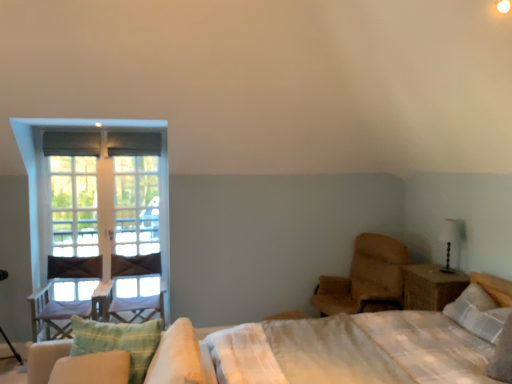
In order to face white textured pillow at upper right, the first pillow in the back-to-front sequence, should I rotate leftwards or rightwards?

You should look right and rotate roughly 27.776 degrees.

The width and height of the screenshot is (512, 384). Find the location of `wooden nightstand at right`. wooden nightstand at right is located at coordinates pos(431,287).

How much space does white wooden window at left, positioned as the 1th window in right-to-left order, occupy vertically?

5.51 feet.

Image resolution: width=512 pixels, height=384 pixels. Describe the element at coordinates (366, 279) in the screenshot. I see `brown leather chair at right, placed as the 1th chair when sorted from right to left` at that location.

Locate an element on the screen. light beige fabric mattress at right is located at coordinates (352, 350).

The width and height of the screenshot is (512, 384). Identify the location of white textured pillow at upper right, the first pillow when ordered from right to left. (478, 313).

From the picture: From their relative heights in the image, would you say brown leather chair at right, placed as the 1th chair when sorted from right to left, is taller or shorter than wooden chair at left, which appears as the first chair when viewed from the left?

Clearly, brown leather chair at right, placed as the 1th chair when sorted from right to left, is taller compared to wooden chair at left, which appears as the first chair when viewed from the left.

Is brown leather chair at right, which is the second chair in left-to-right order, oriented away from wooden chair at left, positioned as the second chair in right-to-left order?

No, brown leather chair at right, which is the second chair in left-to-right order,'s orientation is not away from wooden chair at left, positioned as the second chair in right-to-left order.

Which object is further away from the camera taking this photo, brown leather chair at right, which is the second chair in left-to-right order, or wooden chair at left, positioned as the second chair in right-to-left order?

wooden chair at left, positioned as the second chair in right-to-left order, is more distant.

From the picture: Which object is further away from the camera, wooden chair at left, which appears as the first chair when viewed from the left, or brown leather chair at right, which is the second chair in left-to-right order?

Positioned behind is wooden chair at left, which appears as the first chair when viewed from the left.

In the scene shown: Is wooden chair at left, positioned as the second chair in right-to-left order, next to brown leather chair at right, which is the second chair in left-to-right order?

They are not placed beside each other.

Is wooden chair at left, positioned as the second chair in right-to-left order, shorter than brown leather chair at right, placed as the 1th chair when sorted from right to left?

Indeed, wooden chair at left, positioned as the second chair in right-to-left order, has a lesser height compared to brown leather chair at right, placed as the 1th chair when sorted from right to left.

From a real-world perspective, is wooden chair at left, which appears as the first chair when viewed from the left, above or below brown leather chair at right, which is the second chair in left-to-right order?

wooden chair at left, which appears as the first chair when viewed from the left, is situated lower than brown leather chair at right, which is the second chair in left-to-right order, in the real world.

From the image's perspective, which object appears higher, light beige fabric mattress at right or white wooden window at left, positioned as the 1th window in right-to-left order?

From the image's view, white wooden window at left, positioned as the 1th window in right-to-left order, is above.

In terms of height, does light beige fabric mattress at right look taller or shorter compared to white wooden window at left, positioned as the 1th window in right-to-left order?

Clearly, light beige fabric mattress at right is shorter compared to white wooden window at left, positioned as the 1th window in right-to-left order.

How much distance is there between light beige fabric mattress at right and white wooden window at left, the 2th window from the left?

light beige fabric mattress at right is 2.25 meters from white wooden window at left, the 2th window from the left.

Is light beige fabric mattress at right bigger or smaller than white wooden window at left, the 2th window from the left?

Clearly, light beige fabric mattress at right is larger in size than white wooden window at left, the 2th window from the left.

Does green striped pillow at lower left, the 2th pillow viewed from the back, have a larger size compared to white glass screen door at left?

Yes.

Is green striped pillow at lower left, the 2th pillow viewed from the back, with white glass screen door at left?

There is a gap between green striped pillow at lower left, the 2th pillow viewed from the back, and white glass screen door at left.

Is green striped pillow at lower left, the 2th pillow viewed from the right, oriented towards white glass screen door at left?

No, green striped pillow at lower left, the 2th pillow viewed from the right, is not oriented towards white glass screen door at left.

Which is closer to the camera, (142,327) or (140,172)?

Point (142,327) appears to be closer to the viewer than point (140,172).

Which of these two, matte black table lamp at right or green striped pillow at lower left, marked as the first pillow in a left-to-right arrangement, is thinner?

matte black table lamp at right.

From the image's perspective, is matte black table lamp at right positioned above or below green striped pillow at lower left, marked as the first pillow in a left-to-right arrangement?

matte black table lamp at right is above green striped pillow at lower left, marked as the first pillow in a left-to-right arrangement.

Looking at this image, measure the distance between matte black table lamp at right and green striped pillow at lower left, the 1th pillow positioned from the front.

matte black table lamp at right and green striped pillow at lower left, the 1th pillow positioned from the front, are 8.53 feet apart.

From a real-world perspective, which is physically below, light beige fabric mattress at right or white textured pillow at upper right, the first pillow in the back-to-front sequence?

From a 3D spatial view, light beige fabric mattress at right is below.

Considering the sizes of light beige fabric mattress at right and white textured pillow at upper right, the first pillow in the back-to-front sequence, in the image, is light beige fabric mattress at right bigger or smaller than white textured pillow at upper right, the first pillow in the back-to-front sequence,?

A: Considering their sizes, light beige fabric mattress at right takes up more space than white textured pillow at upper right, the first pillow in the back-to-front sequence.

Can you tell me how much light beige fabric mattress at right and white textured pillow at upper right, the second pillow in the left-to-right sequence, differ in facing direction?

The angle between the facing direction of light beige fabric mattress at right and the facing direction of white textured pillow at upper right, the second pillow in the left-to-right sequence, is 0.000179 degrees.

Considering the positions of objects light beige fabric mattress at right and white textured pillow at upper right, which ranks as the 2th pillow in front-to-back order, in the image provided, who is more to the right, light beige fabric mattress at right or white textured pillow at upper right, which ranks as the 2th pillow in front-to-back order,?

From the viewer's perspective, white textured pillow at upper right, which ranks as the 2th pillow in front-to-back order, appears more on the right side.

This screenshot has width=512, height=384. What are the coordinates of `the 1st chair in front when counting from the wooden swivel chair at left` in the screenshot? It's located at (63, 301).

Does wooden swivel chair at left have a greater height compared to wooden chair at left, which appears as the first chair when viewed from the left?

No.

From the picture: Is there a large distance between wooden swivel chair at left and wooden chair at left, which appears as the first chair when viewed from the left?

Actually, wooden swivel chair at left and wooden chair at left, which appears as the first chair when viewed from the left, are a little close together.

Is wooden swivel chair at left wider or thinner than wooden chair at left, positioned as the second chair in right-to-left order?

In the image, wooden swivel chair at left appears to be wider than wooden chair at left, positioned as the second chair in right-to-left order.

Where is `chair that appears below the brown leather chair at right, which is the second chair in left-to-right order (from the image's perspective)`? Image resolution: width=512 pixels, height=384 pixels. chair that appears below the brown leather chair at right, which is the second chair in left-to-right order (from the image's perspective) is located at coordinates (63, 301).

Where is `chair above the wooden chair at left, which appears as the first chair when viewed from the left (from the image's perspective)`? The height and width of the screenshot is (384, 512). chair above the wooden chair at left, which appears as the first chair when viewed from the left (from the image's perspective) is located at coordinates (366, 279).

Considering their positions, is wooden chair at left, positioned as the second chair in right-to-left order, positioned closer to clear glass window at left, the second window in the right-to-left sequence, than wooden nightstand at right?

wooden chair at left, positioned as the second chair in right-to-left order, lies closer to clear glass window at left, the second window in the right-to-left sequence, than the other object.

Based on their spatial positions, is white glass screen door at left or brown leather chair at right, placed as the 1th chair when sorted from right to left, further from light beige fabric mattress at right?

white glass screen door at left lies further to light beige fabric mattress at right than the other object.

Estimate the real-world distances between objects in this image. Which object is further from green striped pillow at lower left, the 2th pillow viewed from the right, wooden nightstand at right or clear glass window at left, the second window in the right-to-left sequence?

The object further to green striped pillow at lower left, the 2th pillow viewed from the right, is wooden nightstand at right.

From the picture: Based on their spatial positions, is white textured pillow at upper right, the first pillow when ordered from right to left, or clear glass window at left, marked as the first window in a left-to-right arrangement, closer to white glass screen door at left?

clear glass window at left, marked as the first window in a left-to-right arrangement, is closer to white glass screen door at left.

Based on their spatial positions, is brown leather chair at right, which is the second chair in left-to-right order, or wooden swivel chair at left closer to white textured pillow at upper right, the first pillow in the back-to-front sequence?

brown leather chair at right, which is the second chair in left-to-right order, is positioned closer to the anchor white textured pillow at upper right, the first pillow in the back-to-front sequence.

When comparing their distances from brown leather chair at right, placed as the 1th chair when sorted from right to left, does wooden swivel chair at left or white glass screen door at left seem further?

wooden swivel chair at left lies further to brown leather chair at right, placed as the 1th chair when sorted from right to left, than the other object.

When comparing their distances from white glass screen door at left, does wooden chair at left, positioned as the second chair in right-to-left order, or white wooden window at left, positioned as the 1th window in right-to-left order, seem further?

Among the two, white wooden window at left, positioned as the 1th window in right-to-left order, is located further to white glass screen door at left.

Looking at the image, which one is located further to white wooden window at left, positioned as the 1th window in right-to-left order, matte black table lamp at right or clear glass window at left, the second window in the right-to-left sequence?

matte black table lamp at right is positioned further to the anchor white wooden window at left, positioned as the 1th window in right-to-left order.

Where is `mattress between wooden swivel chair at left and white textured pillow at upper right, the first pillow in the back-to-front sequence, from left to right`? The image size is (512, 384). mattress between wooden swivel chair at left and white textured pillow at upper right, the first pillow in the back-to-front sequence, from left to right is located at coordinates (352, 350).

Where is `nightstand between white wooden window at left, the 2th window from the left, and white textured pillow at upper right, the second pillow in the left-to-right sequence`? nightstand between white wooden window at left, the 2th window from the left, and white textured pillow at upper right, the second pillow in the left-to-right sequence is located at coordinates (431, 287).

Where is `swivel chair between white wooden window at left, positioned as the 1th window in right-to-left order, and white textured pillow at upper right, which ranks as the 2th pillow in front-to-back order, from left to right`? This screenshot has height=384, width=512. swivel chair between white wooden window at left, positioned as the 1th window in right-to-left order, and white textured pillow at upper right, which ranks as the 2th pillow in front-to-back order, from left to right is located at coordinates (135, 265).

At what (x,y) coordinates should I click in order to perform the action: click on swivel chair between white wooden window at left, positioned as the 1th window in right-to-left order, and matte black table lamp at right from left to right. Please return your answer as a coordinate pair (x, y). This screenshot has height=384, width=512. Looking at the image, I should click on (135, 265).